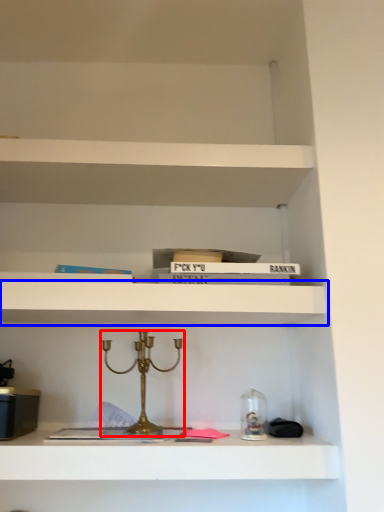
Question: Among these objects, which one is farthest to the camera, candle holder (highlighted by a red box) or shelf (highlighted by a blue box)?

Choices:
 (A) candle holder
 (B) shelf

Answer: (B)